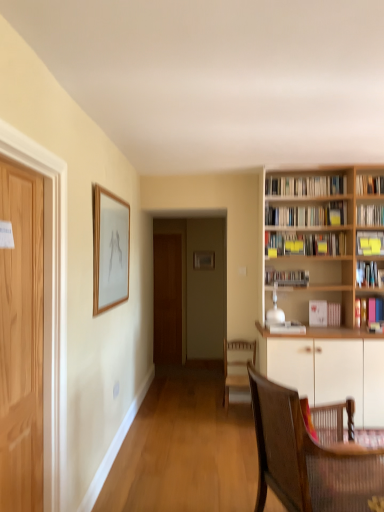
Locate an element on the screen. Image resolution: width=384 pixels, height=512 pixels. vacant space that is to the left of wooden chair at center, which is counted as the second chair, starting from the front is located at coordinates (213, 413).